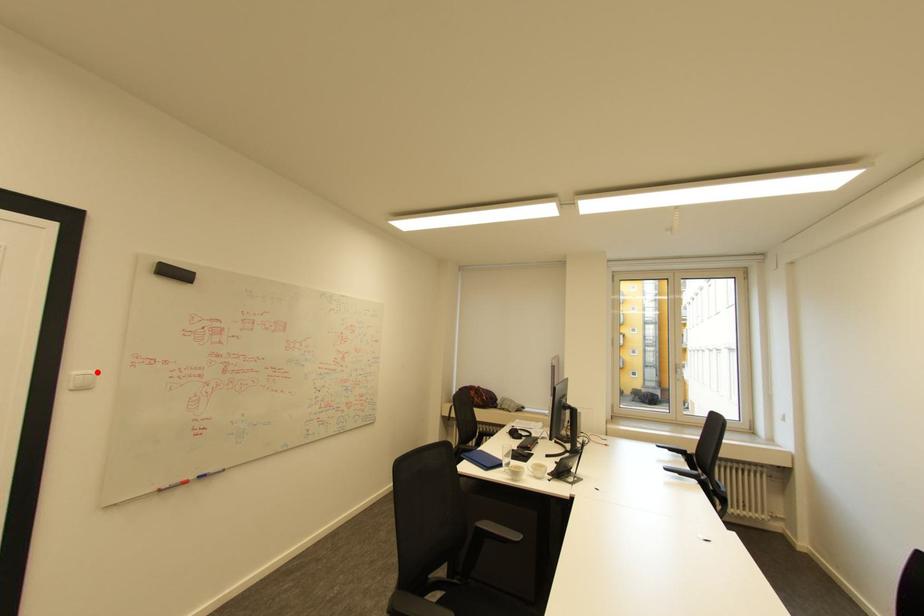
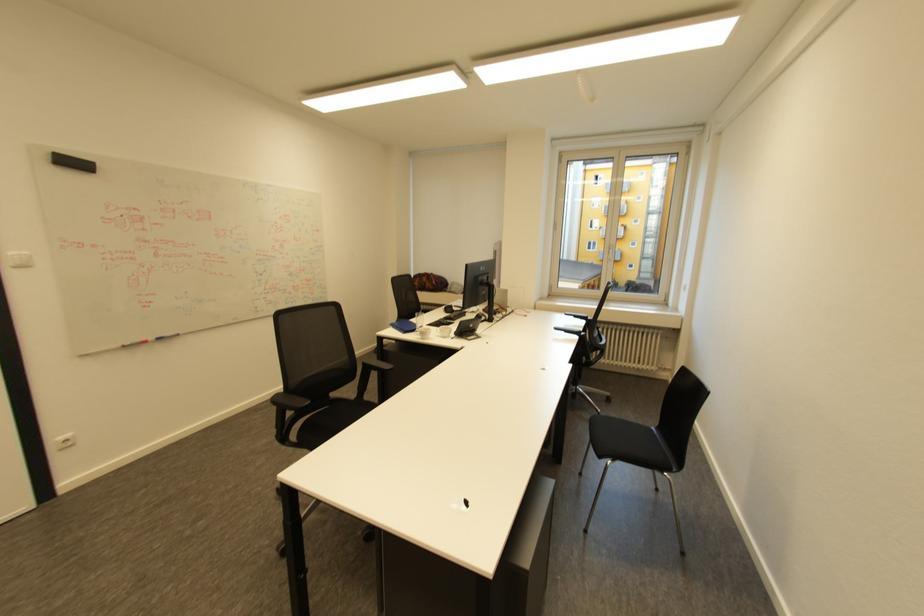
The point at the highlighted location is marked in the first image. Where is the corresponding point in the second image?

(30, 253)